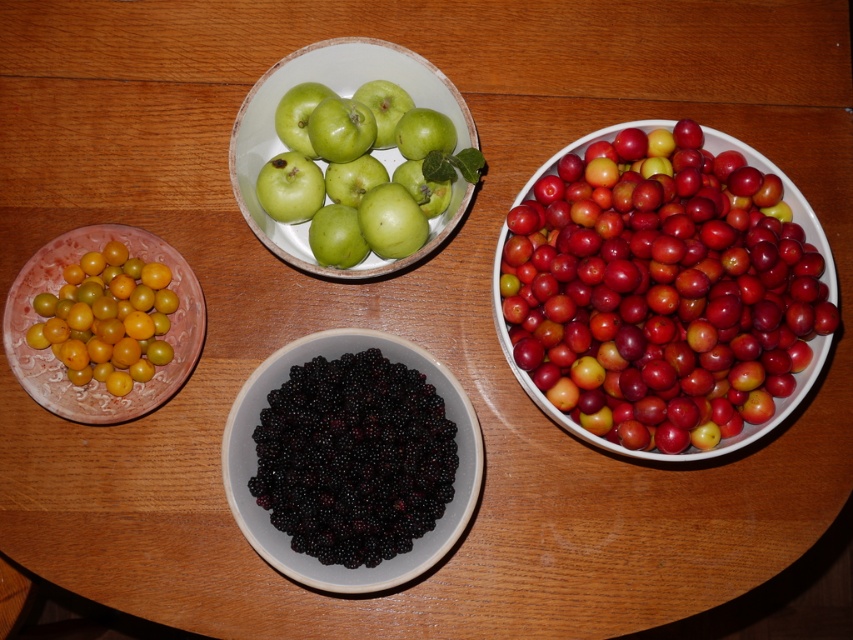
You are standing at the center of the wooden surface where the bowls are arranged in a square. You want to reach the point labeled as point [592,180] first and then point [363,86]. Which direction should you move first to reach the first point without going around the bowls?

To reach point [592,180] first, you should move towards the bottom left direction from the center since point [592,180] is located in the bottom left area relative to point [363,86].